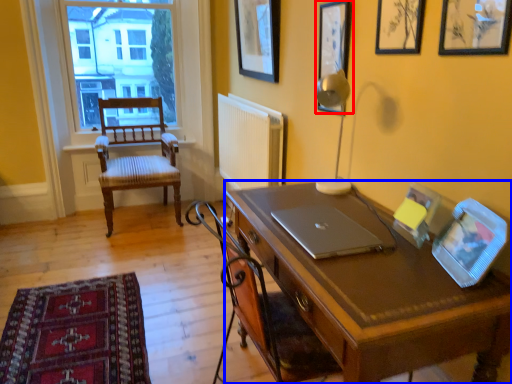
Question: Which point is closer to the camera, picture frame (highlighted by a red box) or desk (highlighted by a blue box)?

Choices:
 (A) picture frame
 (B) desk

Answer: (B)